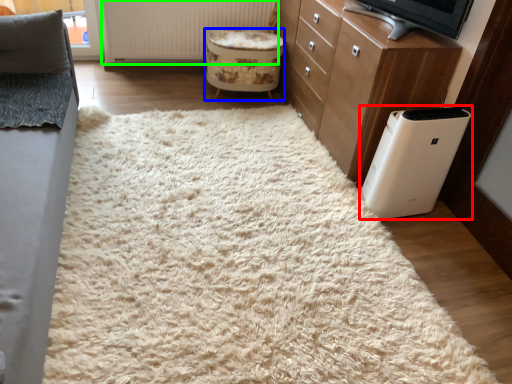
Question: Which object is positioned closest to home appliance (highlighted by a red box)? Select from stool (highlighted by a blue box) and radiator (highlighted by a green box).

Choices:
 (A) stool
 (B) radiator

Answer: (A)